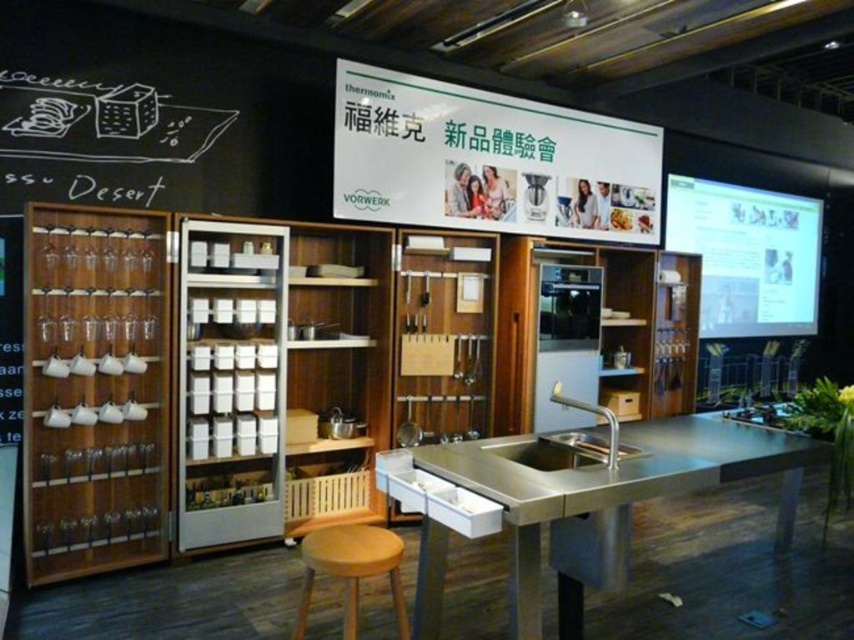
How much distance is there between stainless steel sink at center and light brown wooden stool at center?

A distance of 30.16 inches exists between stainless steel sink at center and light brown wooden stool at center.

Between point (530, 621) and point (352, 637), which one is positioned in front?

Positioned in front is point (352, 637).

Where is `stainless steel sink at center`? This screenshot has width=854, height=640. stainless steel sink at center is located at coordinates [x=577, y=499].

Can you confirm if stainless steel sink at center is thinner than satin nickel sink at center?

In fact, stainless steel sink at center might be wider than satin nickel sink at center.

Describe the element at coordinates (577, 499) in the screenshot. I see `stainless steel sink at center` at that location.

What are the coordinates of `stainless steel sink at center` in the screenshot? It's located at 577,499.

The height and width of the screenshot is (640, 854). What are the coordinates of `stainless steel sink at center` in the screenshot? It's located at (577, 499).

Which is in front, point (468, 529) or point (393, 182)?

Point (468, 529) is more forward.

Is point (521, 557) positioned after point (527, 209)?

No, it is not.

Is point (442, 593) positioned before point (464, 144)?

That is True.

Locate an element on the screen. Image resolution: width=854 pixels, height=640 pixels. stainless steel sink at center is located at coordinates (577, 499).